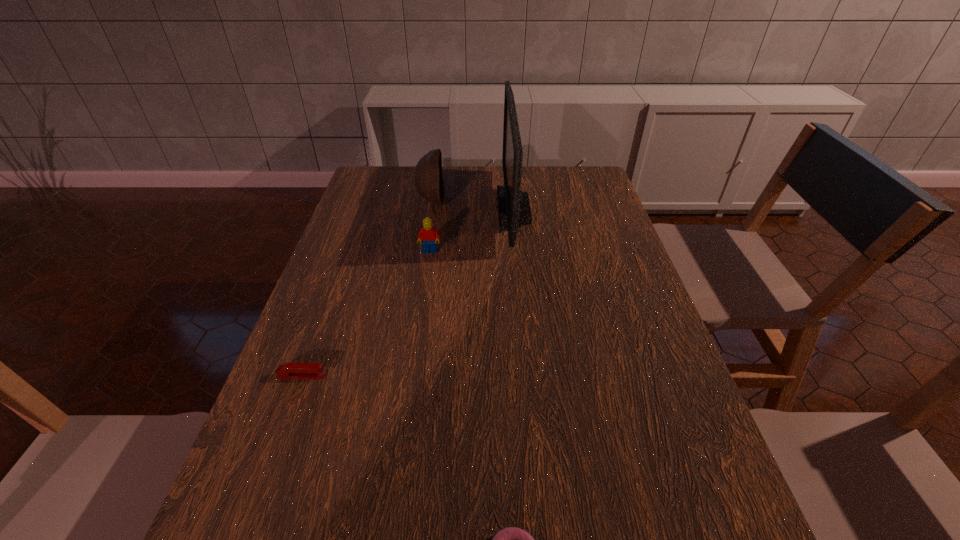
Identify the location of free area in between the second nearest object and the bowl. The height and width of the screenshot is (540, 960). (367, 288).

This screenshot has width=960, height=540. I want to click on free space between the stapler and the monitor, so click(x=408, y=293).

Locate an element on the screen. free spot between the tallest object and the bowl is located at coordinates (472, 205).

Find the location of a particular element. The image size is (960, 540). object identified as the third closest to the bowl is located at coordinates (287, 370).

This screenshot has height=540, width=960. What are the coordinates of `the closest object relative to the nearest object` in the screenshot? It's located at (287, 370).

Image resolution: width=960 pixels, height=540 pixels. Find the location of `free location that satisfies the following two spatial constraints: 1. on the screen side of the tallest object; 2. on the face of the third shortest object`. free location that satisfies the following two spatial constraints: 1. on the screen side of the tallest object; 2. on the face of the third shortest object is located at coordinates [x=518, y=252].

I want to click on free space that satisfies the following two spatial constraints: 1. on the face of the third shortest object; 2. on the front-facing side of the stapler, so click(413, 376).